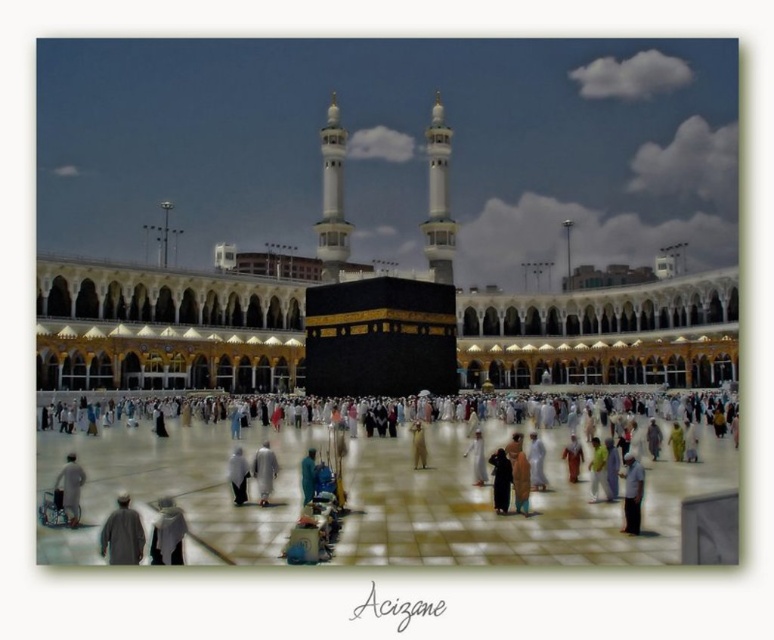
You are standing at the entrance of the Grand Mosque and see the white clothed person at center and the white fabric at lower left. Which object is closer to you?

The white clothed person at center is closer to you because the white fabric at lower left is behind them.